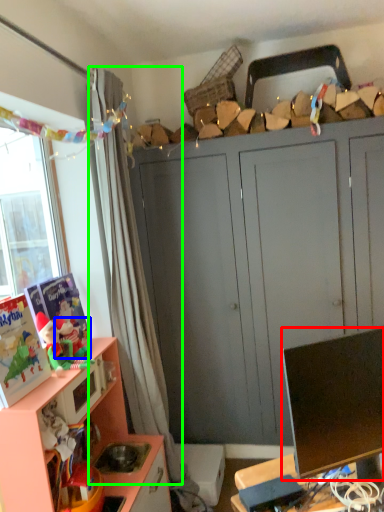
Question: Which is farther away from television (highlighted by a red box)? toy (highlighted by a blue box) or curtain (highlighted by a green box)?

Choices:
 (A) toy
 (B) curtain

Answer: (B)